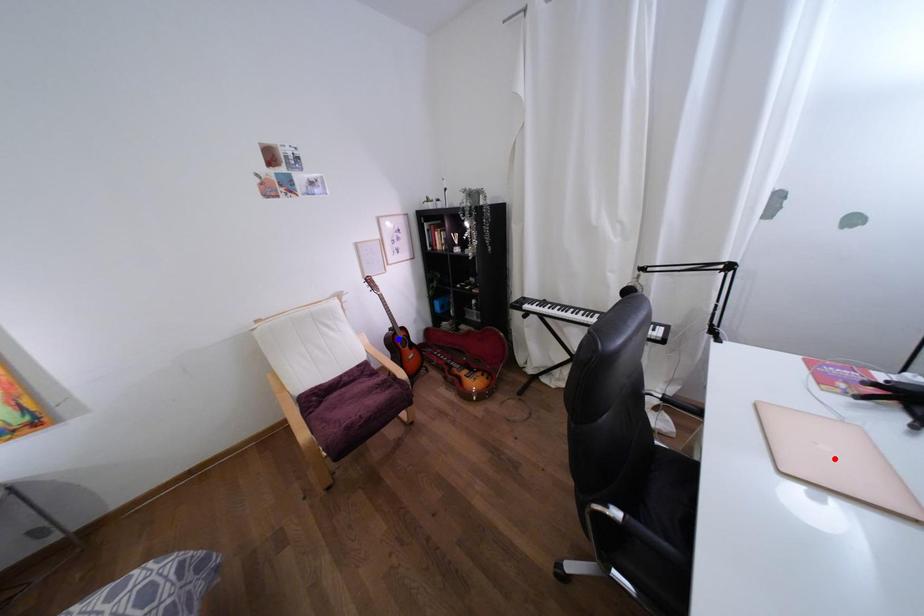
Question: In the image, two points are highlighted. Which point is nearer to the camera? Reply with the corresponding letter.

Choices:
 (A) blue point
 (B) red point

Answer: (B)